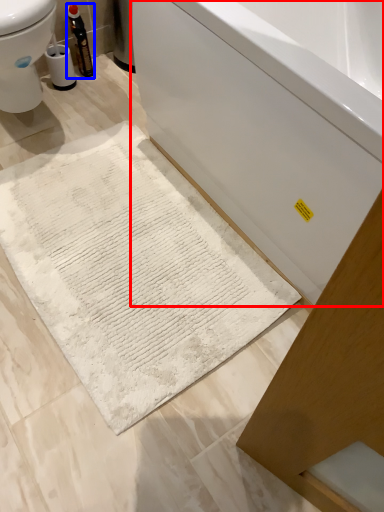
Question: Which object is further to the camera taking this photo, bathtub (highlighted by a red box) or bottle (highlighted by a blue box)?

Choices:
 (A) bathtub
 (B) bottle

Answer: (B)